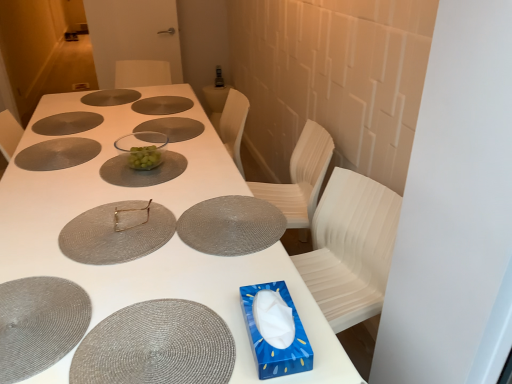
Where is `blank area beneath matte gray placemat at lower center, the ninth glass plate from the back (from a real-world perspective)`? blank area beneath matte gray placemat at lower center, the ninth glass plate from the back (from a real-world perspective) is located at coordinates (156, 343).